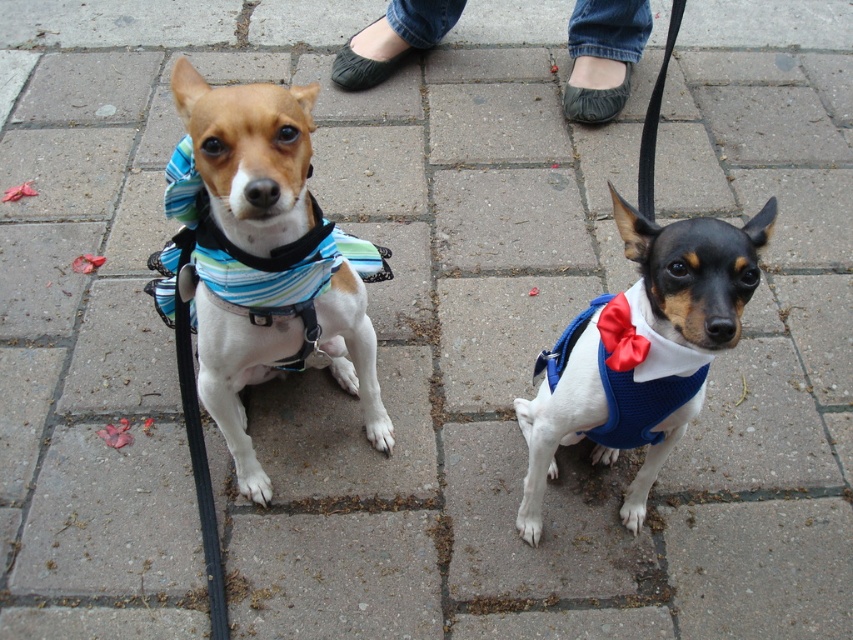
Question: Considering the relative positions of jeans at center and satin blue bow tie at center in the image provided, where is jeans at center located with respect to satin blue bow tie at center?

Choices:
 (A) above
 (B) below

Answer: (A)

Question: Among these objects, which one is farthest from the camera?

Choices:
 (A) satin blue bow tie at center
 (B) jeans at center
 (C) red satin bow tie at center
 (D) blue knitted vest at center

Answer: (B)

Question: Is the position of blue knitted vest at center less distant than that of red satin bow tie at center?

Choices:
 (A) yes
 (B) no

Answer: (A)

Question: Which point is farther to the camera?

Choices:
 (A) (569, 81)
 (B) (241, 282)
 (C) (204, 218)
 (D) (608, 320)

Answer: (A)

Question: Is blue knitted vest at center positioned behind satin blue bow tie at center?

Choices:
 (A) no
 (B) yes

Answer: (A)

Question: Among these objects, which one is nearest to the camera?

Choices:
 (A) satin blue bow tie at center
 (B) jeans at center

Answer: (A)